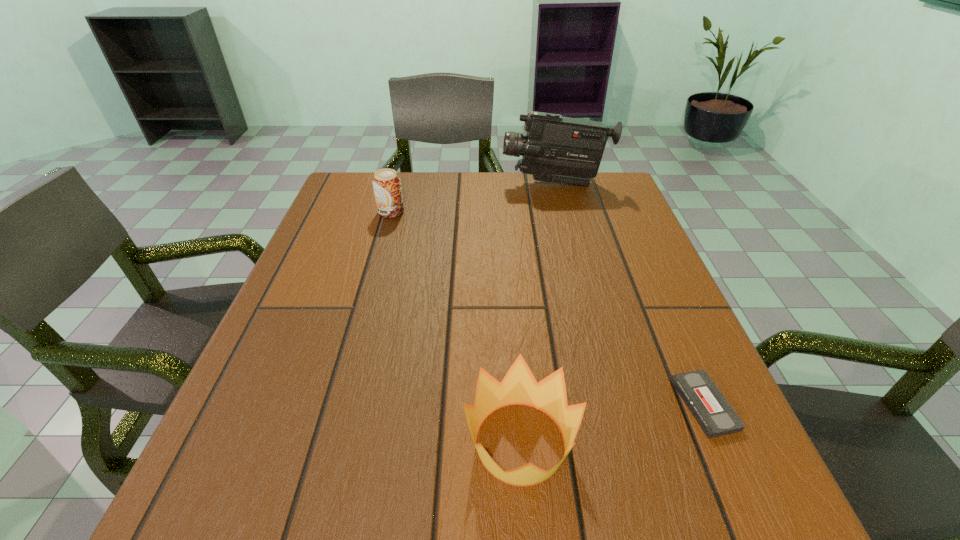
In the image, there is a desktop. At what (x,y) coordinates should I click in order to perform the action: click on vacant region at the far edge. Please return your answer as a coordinate pair (x, y). The width and height of the screenshot is (960, 540). Looking at the image, I should click on (407, 189).

The height and width of the screenshot is (540, 960). I want to click on vacant point at the near edge, so click(x=596, y=534).

Image resolution: width=960 pixels, height=540 pixels. In the image, there is a desktop. In order to click on vacant space at the left edge in this screenshot , I will do `click(282, 348)`.

I want to click on free location at the right edge of the desktop, so click(617, 315).

The height and width of the screenshot is (540, 960). I want to click on free space at the near right corner, so click(682, 487).

Find the location of a particular element. vacant area between the crown and the second farthest object is located at coordinates (456, 327).

Image resolution: width=960 pixels, height=540 pixels. I want to click on free space that is in between the beer can and the videotape, so click(548, 308).

Where is `vacant point located between the crown and the videotape`? The width and height of the screenshot is (960, 540). vacant point located between the crown and the videotape is located at coordinates (612, 423).

Find the location of a particular element. vacant area between the leftmost object and the shortest object is located at coordinates (548, 308).

Identify the location of empty location between the crown and the shortest object. (612, 423).